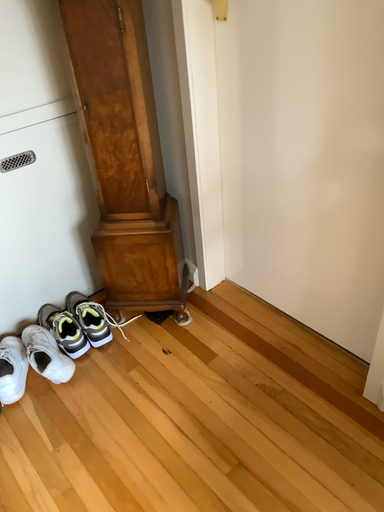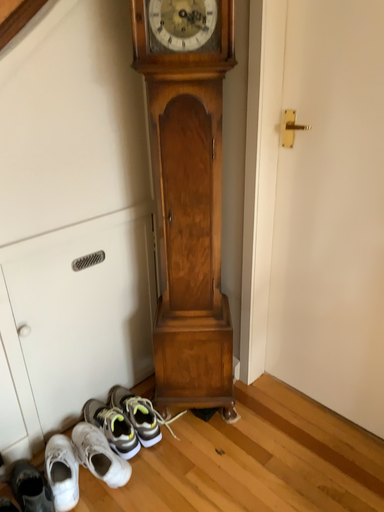
Question: How did the camera likely rotate when shooting the video?

Choices:
 (A) rotated upward
 (B) rotated downward

Answer: (A)